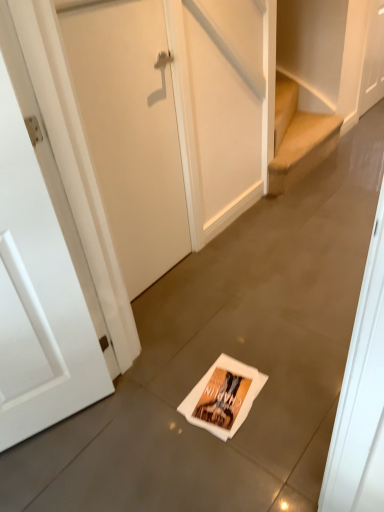
You are a GUI agent. You are given a task and a screenshot of the screen. Output one action in this format:
    pyautogui.click(x=<x>, y=<y>)
    Task: Click on the free space above white paper flyer at center (from a real-world perspective)
    This screenshot has width=384, height=512.
    Given the screenshot: What is the action you would take?
    pyautogui.click(x=215, y=388)